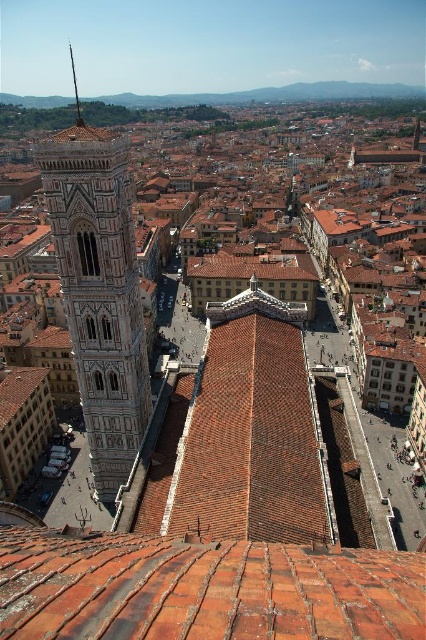
Question: Which of these objects is positioned farthest from the terracotta tiles at center?

Choices:
 (A) polished bronze spire at upper left
 (B) white stone bell tower at left

Answer: (A)

Question: Does white stone bell tower at left have a greater width compared to polished bronze spire at upper left?

Choices:
 (A) no
 (B) yes

Answer: (A)

Question: Can you confirm if terracotta tiles at center is smaller than white stone bell tower at left?

Choices:
 (A) no
 (B) yes

Answer: (B)

Question: Does terracotta tiles at center appear on the right side of polished bronze spire at upper left?

Choices:
 (A) yes
 (B) no

Answer: (A)

Question: Which object appears closest to the camera in this image?

Choices:
 (A) polished bronze spire at upper left
 (B) white stone bell tower at left
 (C) terracotta tiles at center

Answer: (C)

Question: Among these points, which one is farthest from the camera?

Choices:
 (A) (74, 296)
 (B) (78, 118)
 (C) (175, 598)

Answer: (B)